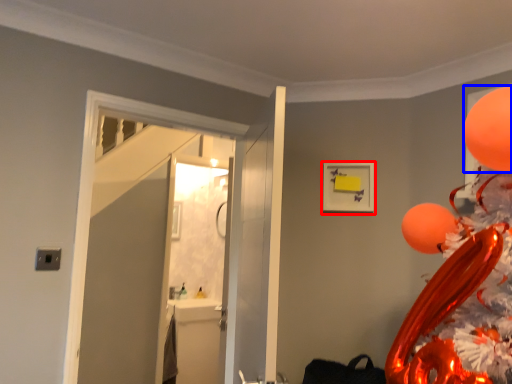
Question: Which point is closer to the camera, picture frame (highlighted by a red box) or balloon (highlighted by a blue box)?

Choices:
 (A) picture frame
 (B) balloon

Answer: (B)